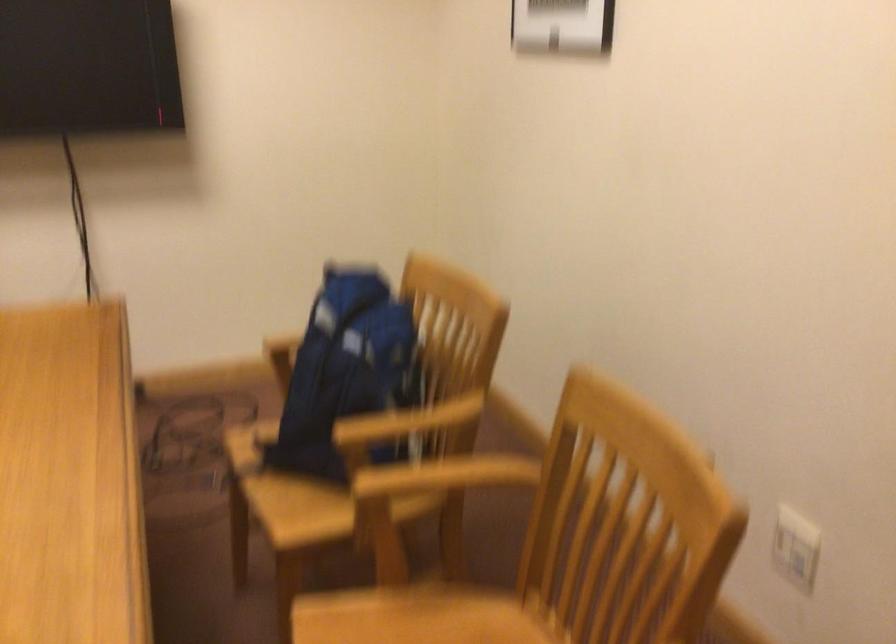
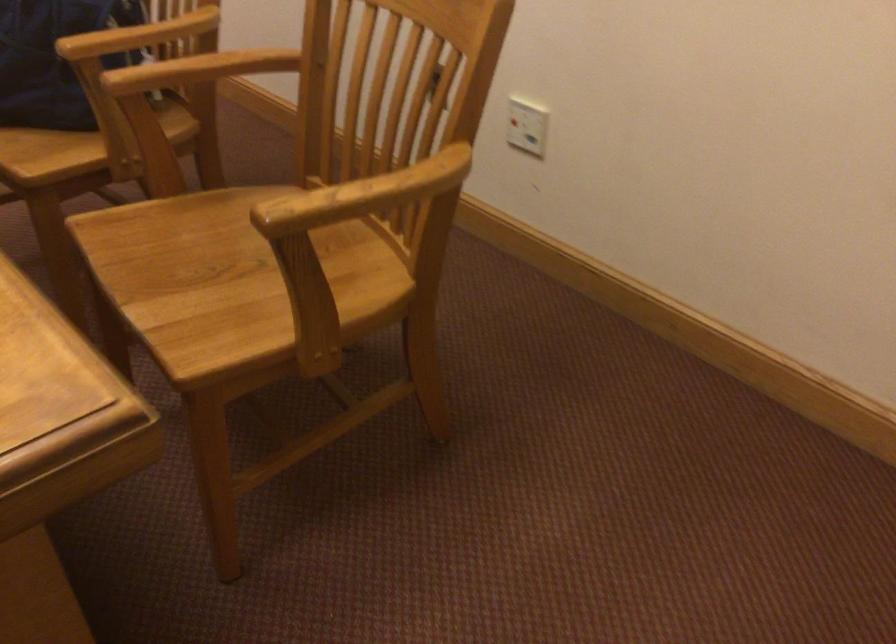
Question: In a continuous first-person perspective shot, in which direction is the camera moving?

Choices:
 (A) Left
 (B) Right
 (C) Forward
 (D) Backward

Answer: (A)